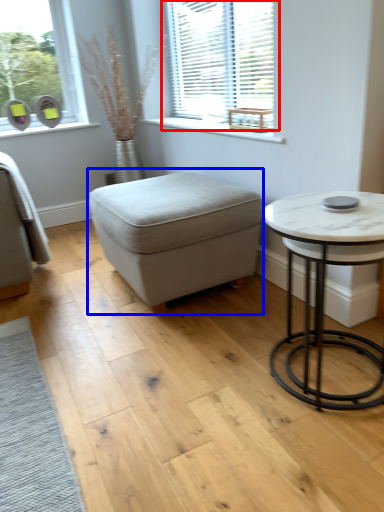
Question: Among these objects, which one is farthest to the camera, window (highlighted by a red box) or music stool (highlighted by a blue box)?

Choices:
 (A) window
 (B) music stool

Answer: (A)